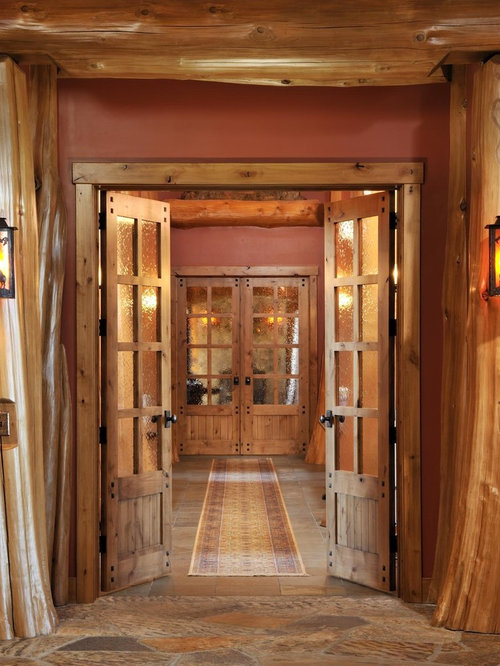
Find the location of a particular element. This screenshot has height=666, width=500. wooden beams is located at coordinates (227, 32), (490, 108), (37, 127), (86, 386), (243, 172), (406, 240), (252, 210).